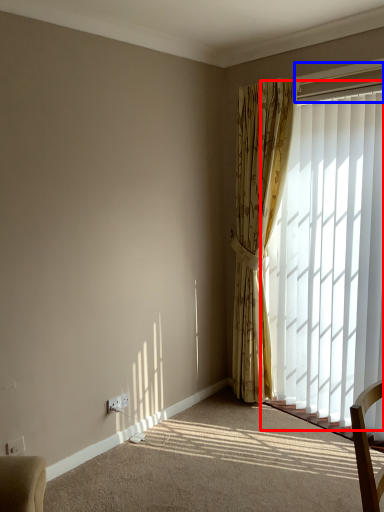
Question: Which object appears farthest to the camera in this image, window (highlighted by a red box) or window frame (highlighted by a blue box)?

Choices:
 (A) window
 (B) window frame

Answer: (B)